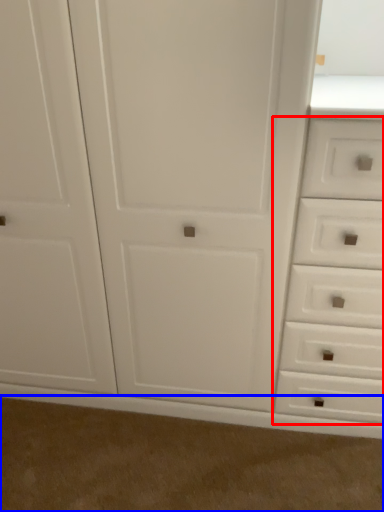
Question: Which of the following is the farthest to the observer, drawer (highlighted by a red box) or plain (highlighted by a blue box)?

Choices:
 (A) drawer
 (B) plain

Answer: (B)